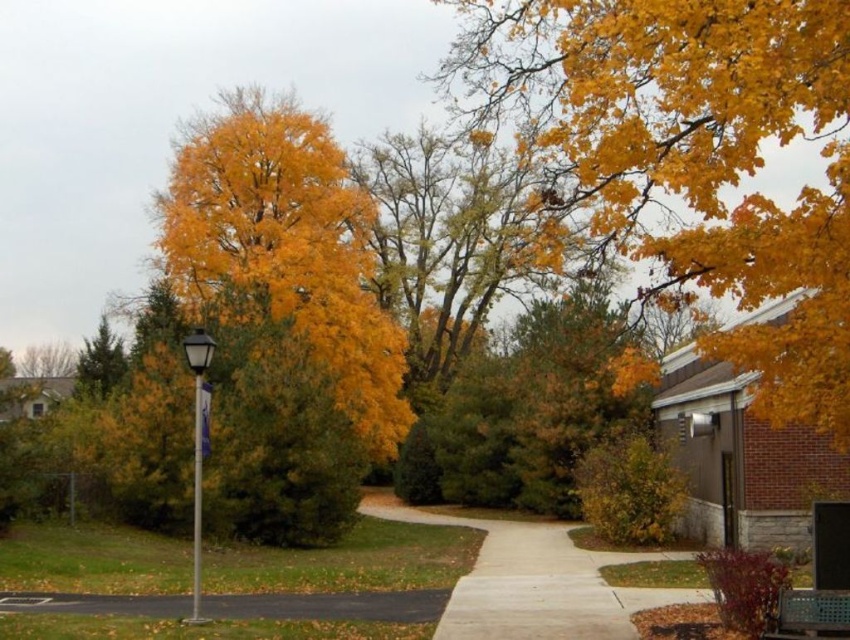
Can you confirm if golden yellow leaves at center is thinner than black asphalt pavement at lower left?

Incorrect, golden yellow leaves at center's width is not less than black asphalt pavement at lower left's.

Can you confirm if golden yellow leaves at center is positioned below black asphalt pavement at lower left?

No.

At what (x,y) coordinates should I click in order to perform the action: click on golden yellow leaves at center. Please return your answer as a coordinate pair (x, y). The width and height of the screenshot is (850, 640). Looking at the image, I should click on (289, 248).

This screenshot has height=640, width=850. Find the location of `golden yellow leaves at center`. golden yellow leaves at center is located at coordinates (289, 248).

Is wooden park bench at lower right positioned behind silver metallic street sign at left?

No, wooden park bench at lower right is in front of silver metallic street sign at left.

Can you confirm if wooden park bench at lower right is positioned to the right of silver metallic street sign at left?

Indeed, wooden park bench at lower right is positioned on the right side of silver metallic street sign at left.

Does point (772, 636) lie behind point (201, 420)?

No.

This screenshot has width=850, height=640. In order to click on wooden park bench at lower right in this screenshot , I will do `click(809, 614)`.

Does yellow matte tree at upper right have a greater height compared to wooden park bench at lower right?

Correct, yellow matte tree at upper right is much taller as wooden park bench at lower right.

Does point (514, 88) come farther from viewer compared to point (813, 609)?

Yes, point (514, 88) is behind point (813, 609).

Locate an element on the screen. The height and width of the screenshot is (640, 850). yellow matte tree at upper right is located at coordinates (695, 156).